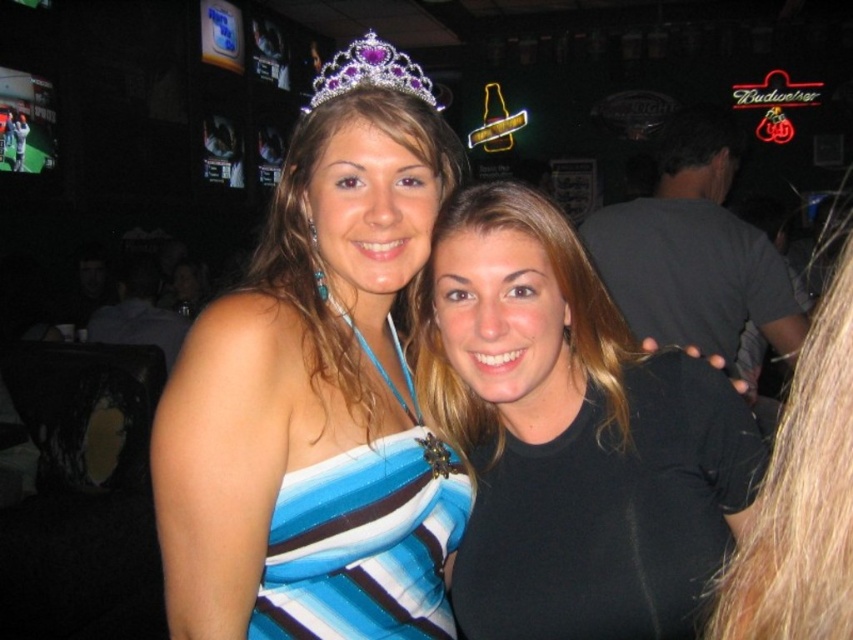
From the picture: You are a photographer at a pageant event. You need to arrange two dresses in the center of the image for a photo shoot. The dresses are the blue satin dress at center and the blue striped fabric dress at center. Which dress should you place further to the right to ensure both fit within the frame?

The blue satin dress at center is wider than the blue striped fabric dress at center. To ensure both fit within the frame, place the wider blue satin dress at center on the left and the narrower blue striped fabric dress at center further to the right.

You are a photographer setting up for a photoshoot. You need to position a backdrop that is 2 meters tall. The backdrop needs to be tall enough to cover both the blue satin dress at center and the blue striped fabric dress at center. Will the backdrop be sufficient?

The blue satin dress at center is taller than the blue striped fabric dress at center. Since the backdrop is 2 meters tall, it will be sufficient to cover both dresses as the tallest dress does not exceed the backdrop height.